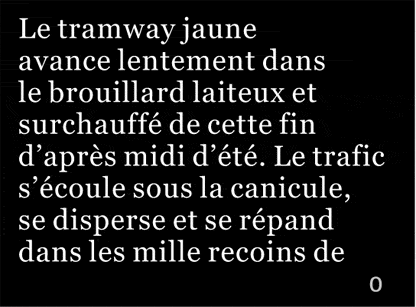
At what (x,y) coordinates should I click in order to perform the action: click on timer. Please return your answer as a coordinate pair (x, y). Looking at the image, I should click on (364, 283).